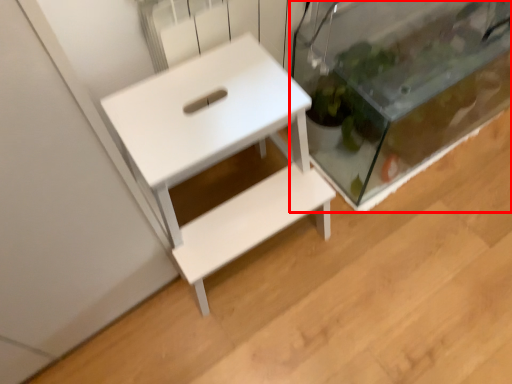
Question: Considering the relative positions of glass box (annotated by the red box) and table in the image provided, where is glass box (annotated by the red box) located with respect to the staircase?

Choices:
 (A) left
 (B) right

Answer: (B)